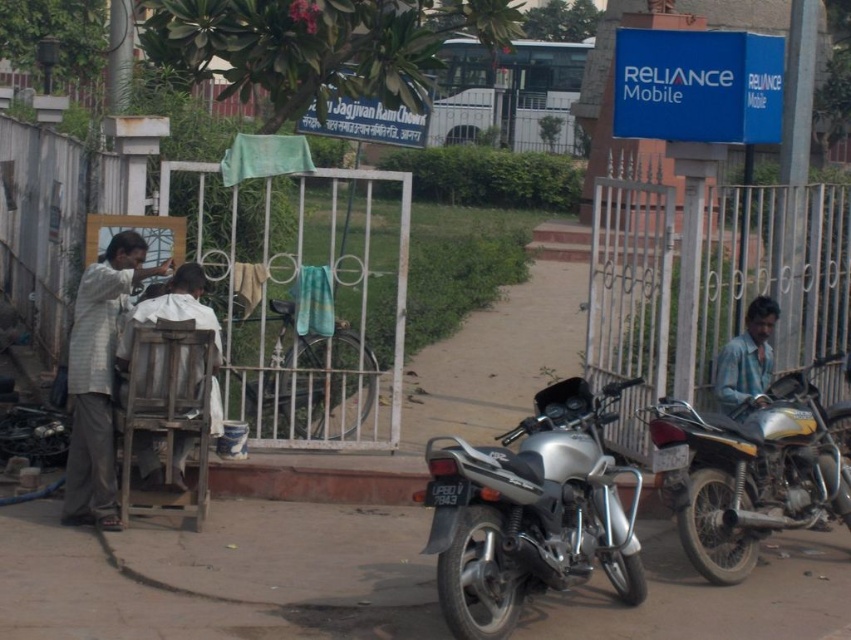
You are a delivery person trying to find the address of the person wearing the light gray striped shirt at left. You see the silver metallic motorcycle at center. Which direction should you move relative to the motorcycle to reach the shirt?

The silver metallic motorcycle at center is below the light gray striped shirt at left, so you should move upward from the motorcycle to reach the light gray striped shirt at left.

Based on the photo, you are a photographer taking a portrait of both the short brown hair at center and the brown matte hair at upper left. To ensure both subjects are in frame, should you adjust your camera to the left or right?

The short brown hair at center is positioned on the right side of brown matte hair at upper left. To include both subjects in the frame, you should adjust your camera to the right to capture the short brown hair at center and the brown matte hair at upper left.